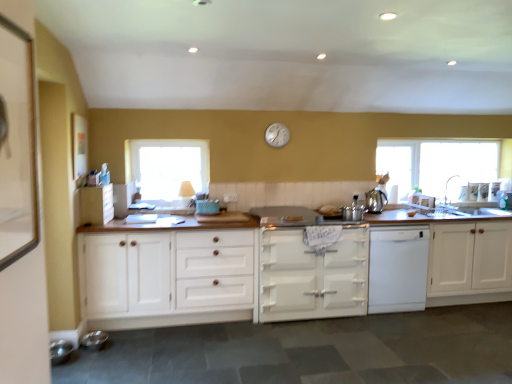
Where is `vacant space underneath metallic silver bowl at lower left, which is the second appliance in bottom-to-top order (from a real-world perspective)`? vacant space underneath metallic silver bowl at lower left, which is the second appliance in bottom-to-top order (from a real-world perspective) is located at coordinates (97, 342).